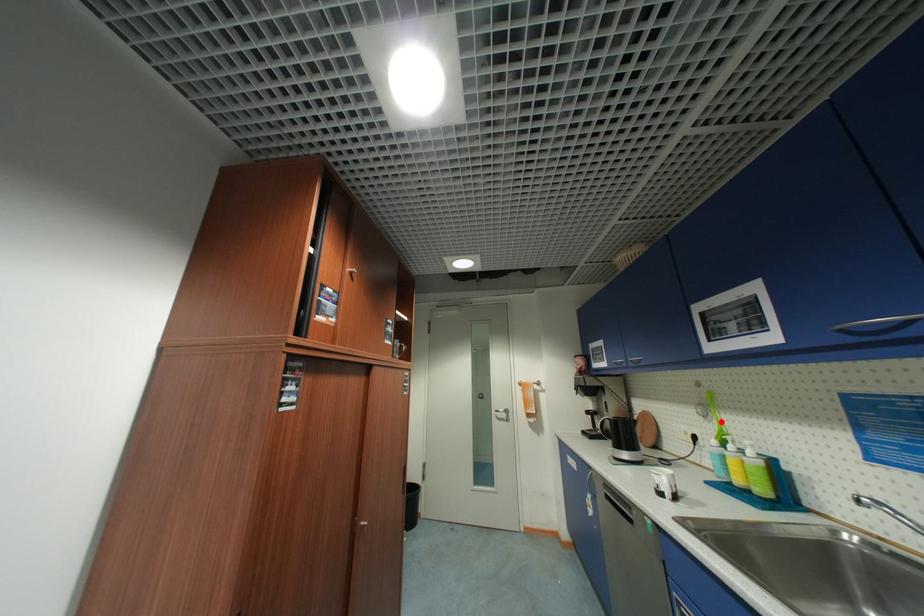
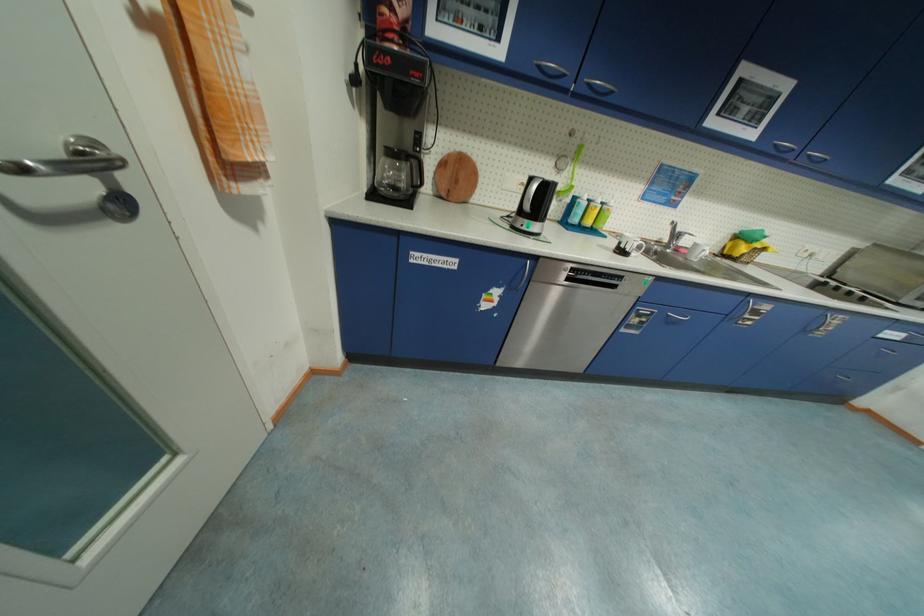
In the second image, find the point that corresponds to the highlighted location in the first image.

(570, 175)